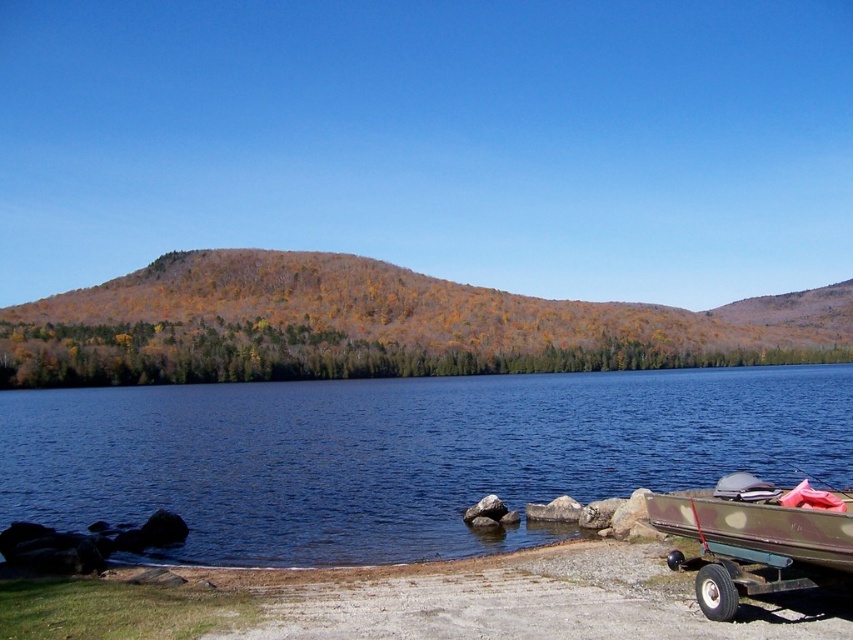
Question: Does blue water at lower center have a smaller size compared to camouflage fabric boat at lower right?

Choices:
 (A) yes
 (B) no

Answer: (B)

Question: Which point is closer to the camera?

Choices:
 (A) camouflage fabric boat at lower right
 (B) blue water at lower center

Answer: (A)

Question: Is the position of blue water at lower center more distant than that of camouflage fabric boat at lower right?

Choices:
 (A) no
 (B) yes

Answer: (B)

Question: Is blue water at lower center positioned before camouflage fabric boat at lower right?

Choices:
 (A) yes
 (B) no

Answer: (B)

Question: Which of the following is the closest to the observer?

Choices:
 (A) blue water at lower center
 (B) camouflage fabric boat at lower right

Answer: (B)